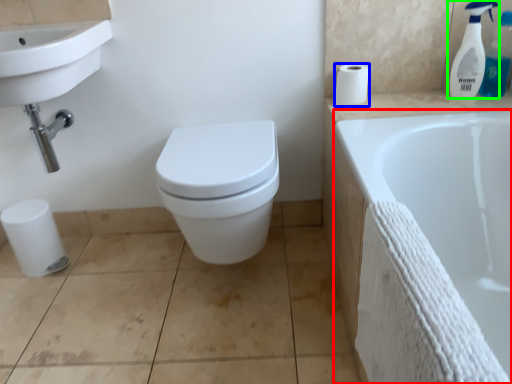
Question: Considering the real-world distances, which object is farthest from bathtub (highlighted by a red box)? toilet paper (highlighted by a blue box) or cleaning product (highlighted by a green box)?

Choices:
 (A) toilet paper
 (B) cleaning product

Answer: (B)